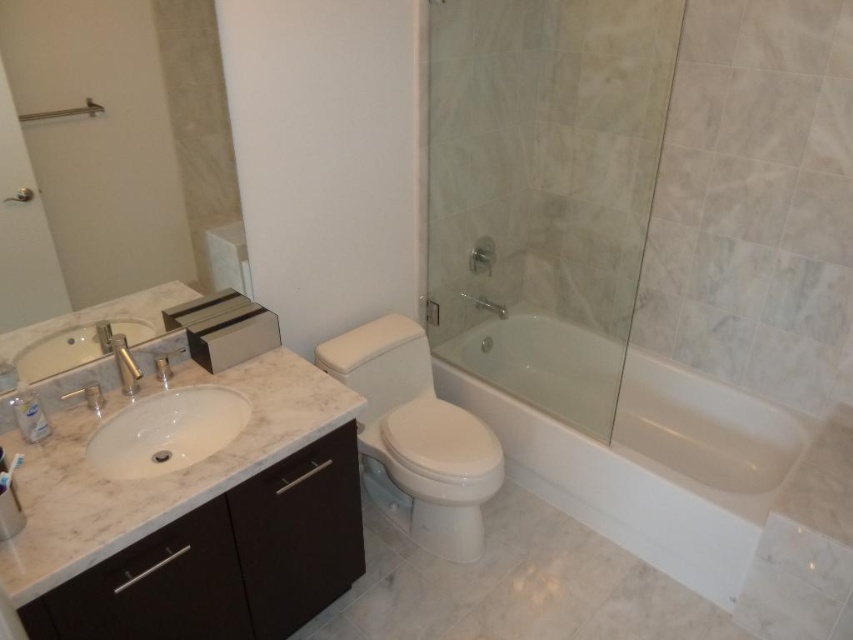
You are a plumber inspecting the bathroom. You need to locate the water shut off valve for the matte silver faucet at left. According to the scene, where would you expect to find it relative to the white glossy bathtub at center?

The white glossy bathtub at center is below the matte silver faucet at left, so the water shut off valve for the matte silver faucet at left would likely be located above the white glossy bathtub at center.

You are standing in the bathroom and want to wash your hands. The white glossy toilet at center is in your way. Can you move around it to reach the matte silver faucet at left?

The matte silver faucet at left is behind the white glossy toilet at center, so you cannot directly reach it by moving around the toilet. You would need to go around the toilet to the sides or find another path to access the matte silver faucet at left.